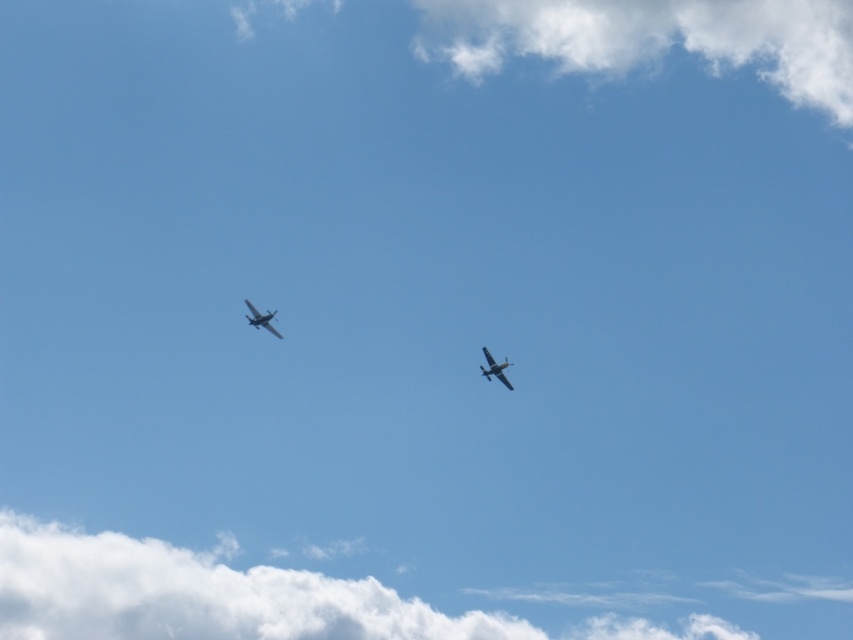
Is white fluffy cloud at lower left above metallic silver airplane at upper center?

Actually, white fluffy cloud at lower left is below metallic silver airplane at upper center.

Which is in front, point (242, 586) or point (492, 364)?

Positioned in front is point (492, 364).

Is point (334, 593) positioned behind point (502, 381)?

Yes, it is.

At what (x,y) coordinates should I click in order to perform the action: click on white fluffy cloud at lower left. Please return your answer as a coordinate pair (x, y). The image size is (853, 640). Looking at the image, I should click on (200, 595).

Does white fluffy cloud at lower left appear under metallic silver airplane at upper left?

Yes, white fluffy cloud at lower left is below metallic silver airplane at upper left.

Is white fluffy cloud at lower left closer to the viewer compared to metallic silver airplane at upper left?

No, it is not.

Is point (178, 625) more distant than point (247, 301)?

Yes, point (178, 625) is farther from viewer.

The height and width of the screenshot is (640, 853). I want to click on white fluffy cloud at lower left, so click(x=200, y=595).

Looking at this image, can you confirm if white fluffy cloud at upper center is taller than metallic silver airplane at upper left?

Indeed, white fluffy cloud at upper center has a greater height compared to metallic silver airplane at upper left.

What do you see at coordinates (654, 38) in the screenshot? I see `white fluffy cloud at upper center` at bounding box center [654, 38].

What do you see at coordinates (654, 38) in the screenshot? This screenshot has height=640, width=853. I see `white fluffy cloud at upper center` at bounding box center [654, 38].

Where is `white fluffy cloud at upper center`? white fluffy cloud at upper center is located at coordinates (654, 38).